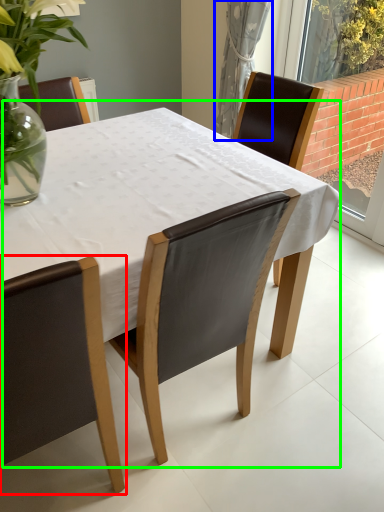
Question: Considering the real-world distances, which object is farthest from chair (highlighted by a red box)? curtain (highlighted by a blue box) or table (highlighted by a green box)?

Choices:
 (A) curtain
 (B) table

Answer: (A)